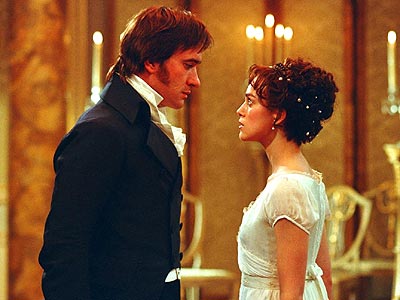
Locate an element on the screen. The image size is (400, 300). candle flame is located at coordinates (96, 37), (250, 30), (258, 33), (271, 20), (279, 30), (288, 32), (390, 36).